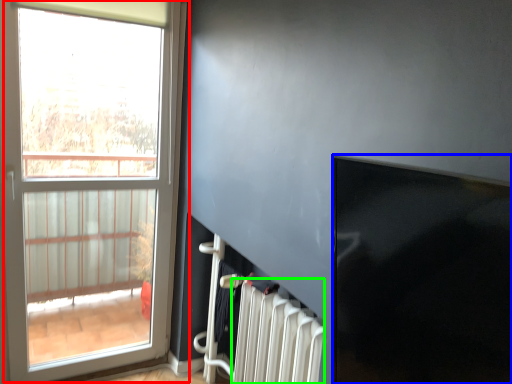
Question: Which object is the farthest from window (highlighted by a red box)? Choose among these: window screen (highlighted by a blue box) or radiator (highlighted by a green box).

Choices:
 (A) window screen
 (B) radiator

Answer: (A)